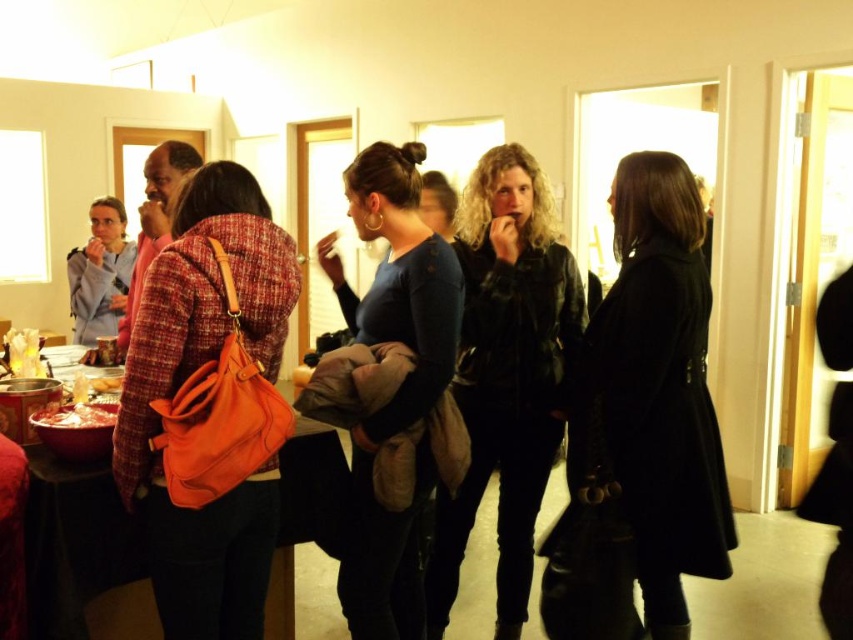
Does black leather coat at center appear on the right side of orange leather bag at left?

Correct, you'll find black leather coat at center to the right of orange leather bag at left.

Does black leather coat at center appear over orange leather bag at left?

No.

Is point (704, 314) closer to viewer compared to point (146, 353)?

No, (704, 314) is further to viewer.

This screenshot has width=853, height=640. What are the coordinates of `black leather coat at center` in the screenshot? It's located at (662, 384).

Can you confirm if leather jacket at center is positioned below orange leather bag at left?

Yes.

Is leather jacket at center closer to camera compared to orange leather bag at left?

No, leather jacket at center is behind orange leather bag at left.

Where is `leather jacket at center`? This screenshot has width=853, height=640. leather jacket at center is located at coordinates (506, 374).

I want to click on leather jacket at center, so click(506, 374).

Is black leather coat at center wider than blue cotton sweater at center?

Indeed, black leather coat at center has a greater width compared to blue cotton sweater at center.

Which is in front, point (666, 410) or point (421, 468)?

Point (421, 468) is in front.

Locate an element on the screen. The width and height of the screenshot is (853, 640). black leather coat at center is located at coordinates (662, 384).